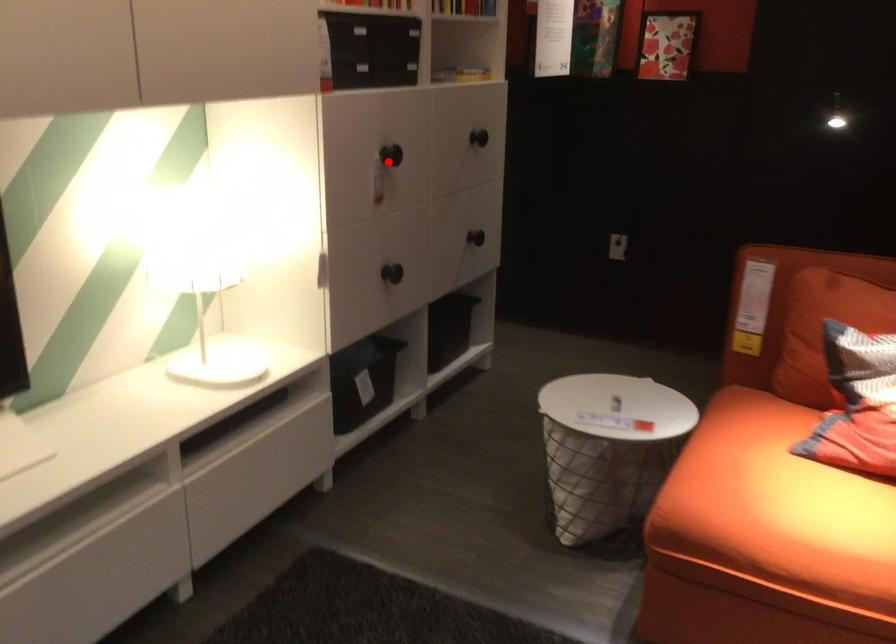
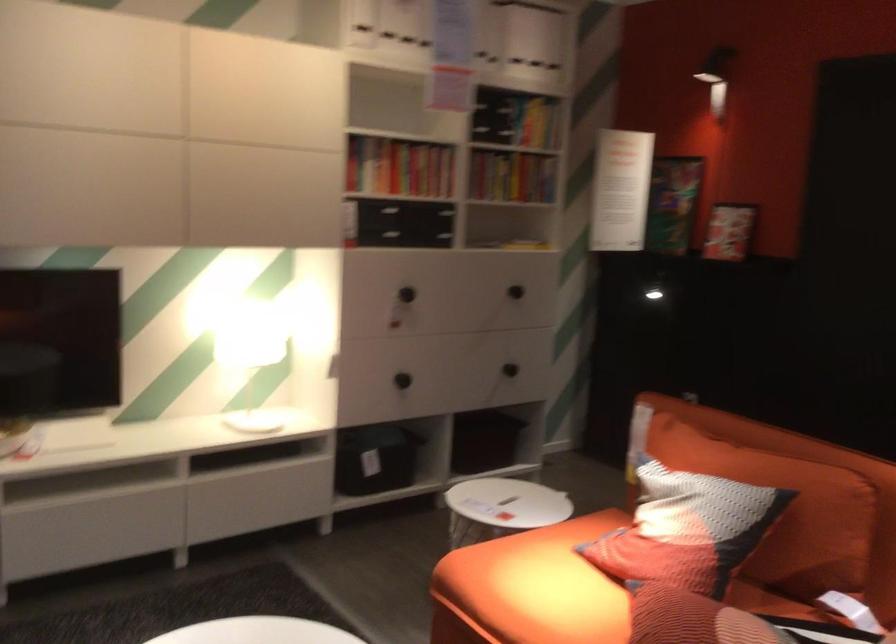
Question: A red point is marked in image1. In image2, is the corresponding 3D point closer to the camera or farther? Reply with the corresponding letter.

Choices:
 (A) The corresponding 3D point is closer.
 (B) The corresponding 3D point is farther.

Answer: (B)